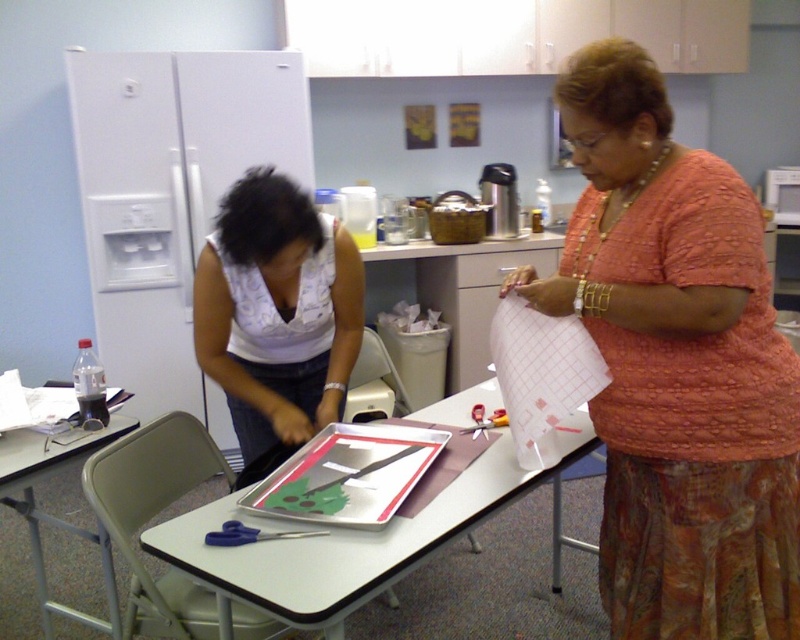
Does point (308, 536) come farther from viewer compared to point (505, 412)?

That is False.

This screenshot has width=800, height=640. In order to click on blue plastic scissors at lower left in this screenshot , I will do `click(250, 534)`.

The height and width of the screenshot is (640, 800). In order to click on blue plastic scissors at lower left in this screenshot , I will do `click(250, 534)`.

Can you confirm if white printed shirt at center is thinner than white grid paper at right?

No, white printed shirt at center is not thinner than white grid paper at right.

Can you confirm if white printed shirt at center is positioned to the left of white grid paper at right?

Yes, white printed shirt at center is to the left of white grid paper at right.

Does point (325, 285) come behind point (554, 456)?

That is True.

Find the location of a particular element. Image resolution: width=800 pixels, height=640 pixels. white printed shirt at center is located at coordinates (277, 310).

Is point (57, 464) positioned after point (486, 420)?

No.

Which is behind, point (84, 620) or point (480, 426)?

The point (84, 620) is behind.

Is point (5, 467) positioned after point (490, 416)?

No, (5, 467) is in front of (490, 416).

Find the location of a particular element. Image resolution: width=800 pixels, height=640 pixels. metallic gray table at lower left is located at coordinates (54, 516).